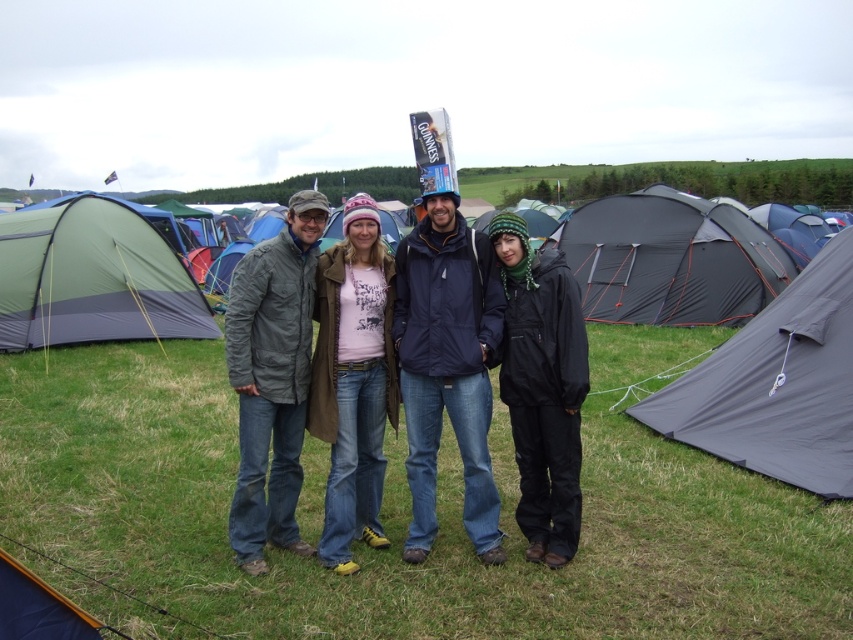
Question: Considering the real-world distances, which object is farthest from the green fabric tent at left?

Choices:
 (A) pink cotton t-shirt at center
 (B) dark gray fabric tent at right
 (C) black waterproof jacket at center
 (D) dark gray nylon tent at right

Answer: (D)

Question: Among these objects, which one is nearest to the camera?

Choices:
 (A) black waterproof jacket at center
 (B) matte gray jacket at center
 (C) dark gray nylon tent at right

Answer: (A)

Question: Does green fabric tent at left come behind pink cotton t-shirt at center?

Choices:
 (A) no
 (B) yes

Answer: (B)

Question: Is matte gray jacket at center wider than dark gray nylon tent at right?

Choices:
 (A) no
 (B) yes

Answer: (A)

Question: Estimate the real-world distances between objects in this image. Which object is farther from the pink cotton t-shirt at center?

Choices:
 (A) dark gray fabric tent at right
 (B) green fabric tent at left
 (C) matte gray jacket at center

Answer: (B)

Question: Does pink cotton t-shirt at center lie behind black waterproof jacket at center?

Choices:
 (A) no
 (B) yes

Answer: (B)